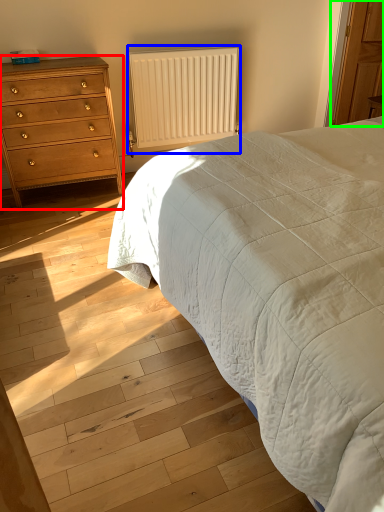
Question: Which object is positioned farthest from chest of drawers (highlighted by a red box)? Select from radiator (highlighted by a blue box) and armoire (highlighted by a green box).

Choices:
 (A) radiator
 (B) armoire

Answer: (B)